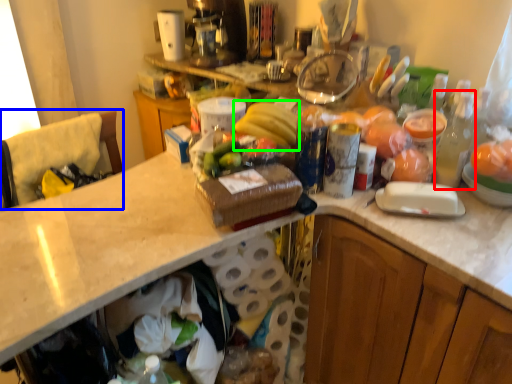
Question: Considering the real-world distances, which object is farthest from bottle (highlighted by a red box)? leftover (highlighted by a blue box) or banana (highlighted by a green box)?

Choices:
 (A) leftover
 (B) banana

Answer: (A)